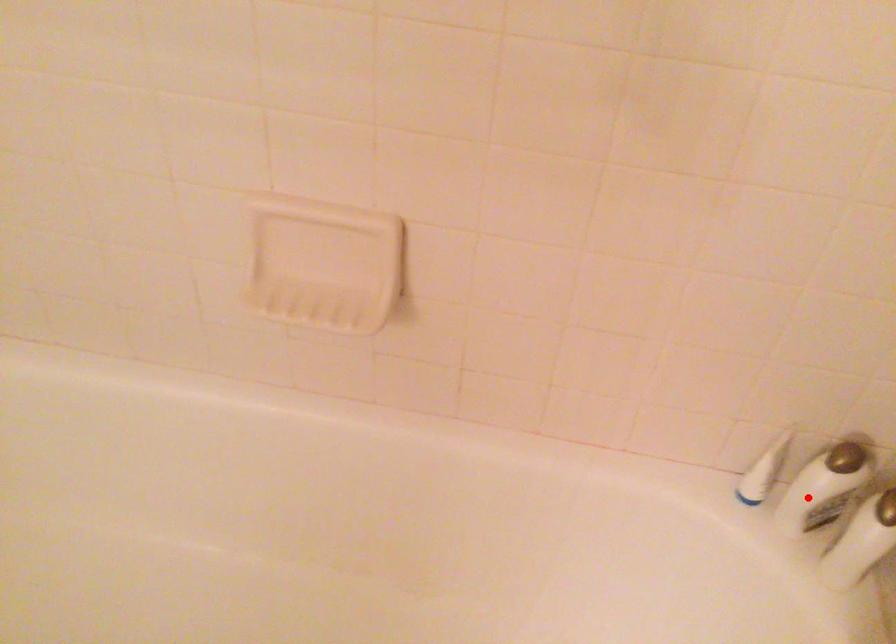
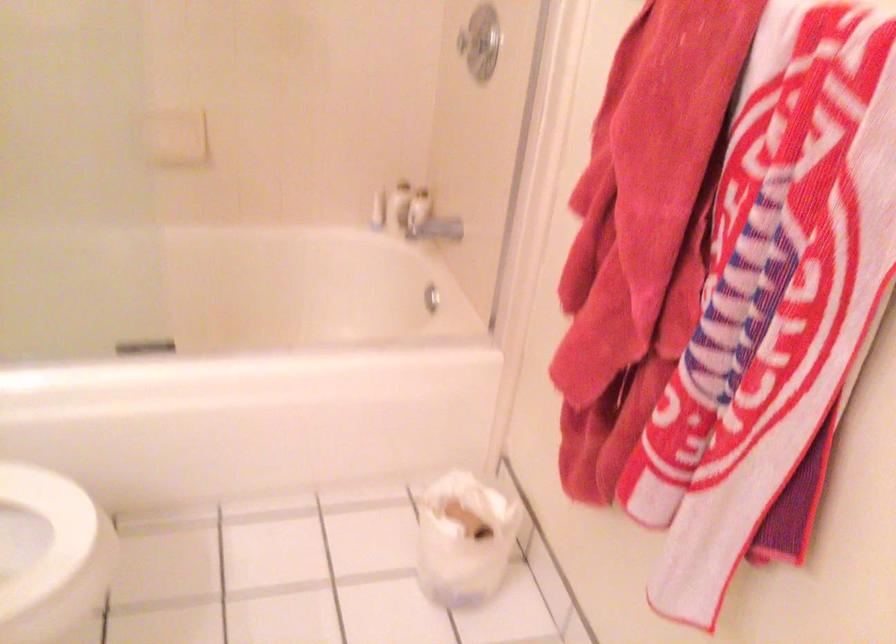
Where in the second image is the point corresponding to the highlighted location from the first image?

(399, 205)